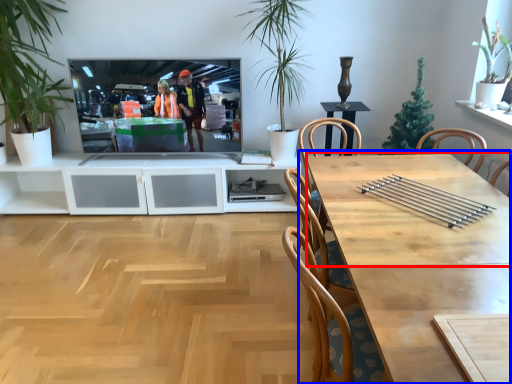
Question: Which of the following is the farthest to the observer, counter top (highlighted by a red box) or table (highlighted by a blue box)?

Choices:
 (A) counter top
 (B) table

Answer: (A)